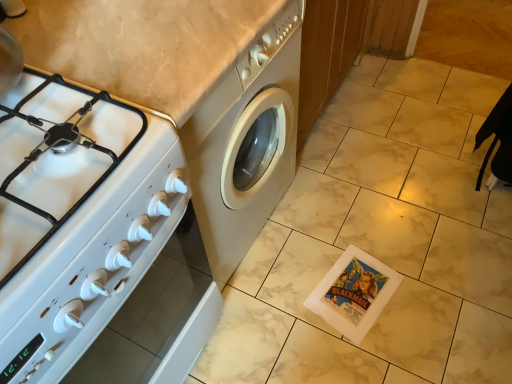
Describe the element at coordinates (76, 217) in the screenshot. Image resolution: width=512 pixels, height=384 pixels. I see `white glossy gas stove at left` at that location.

Identify the location of white glossy gas stove at left. The height and width of the screenshot is (384, 512). (76, 217).

Image resolution: width=512 pixels, height=384 pixels. I want to click on white glossy gas stove at left, so click(x=76, y=217).